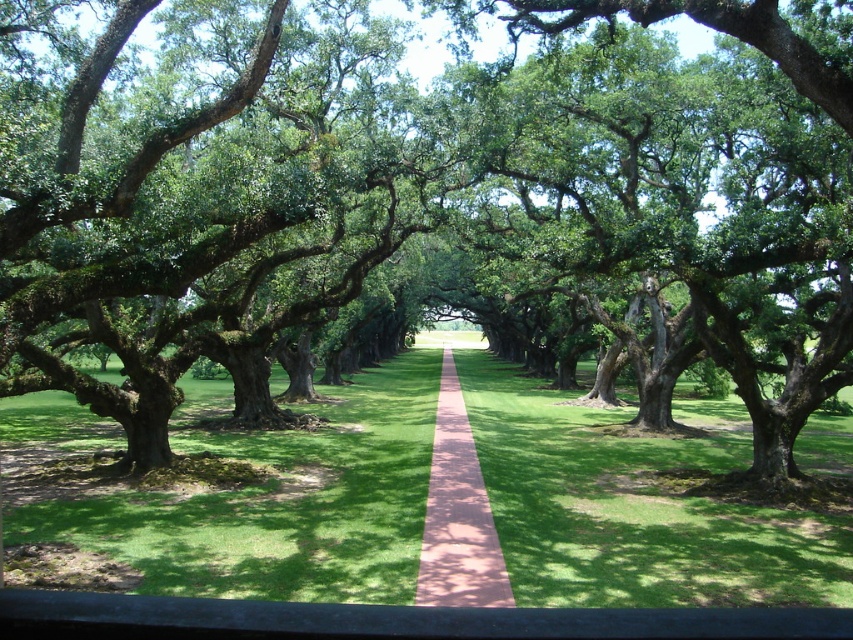
Between green grass at center and pink concrete path at center, which one has less height?

pink concrete path at center

What do you see at coordinates (634, 506) in the screenshot? I see `green grass at center` at bounding box center [634, 506].

The image size is (853, 640). I want to click on green grass at center, so click(x=634, y=506).